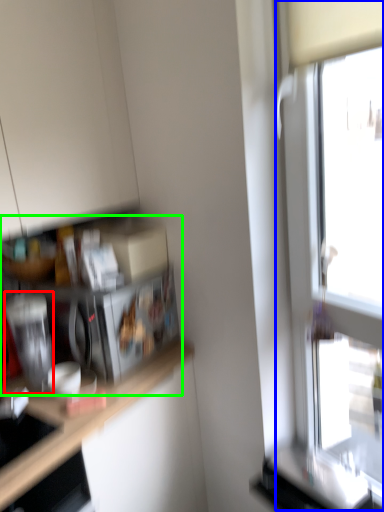
Question: Which is farther away from appliance (highlighted by a red box)? window (highlighted by a blue box) or shelf (highlighted by a green box)?

Choices:
 (A) window
 (B) shelf

Answer: (A)